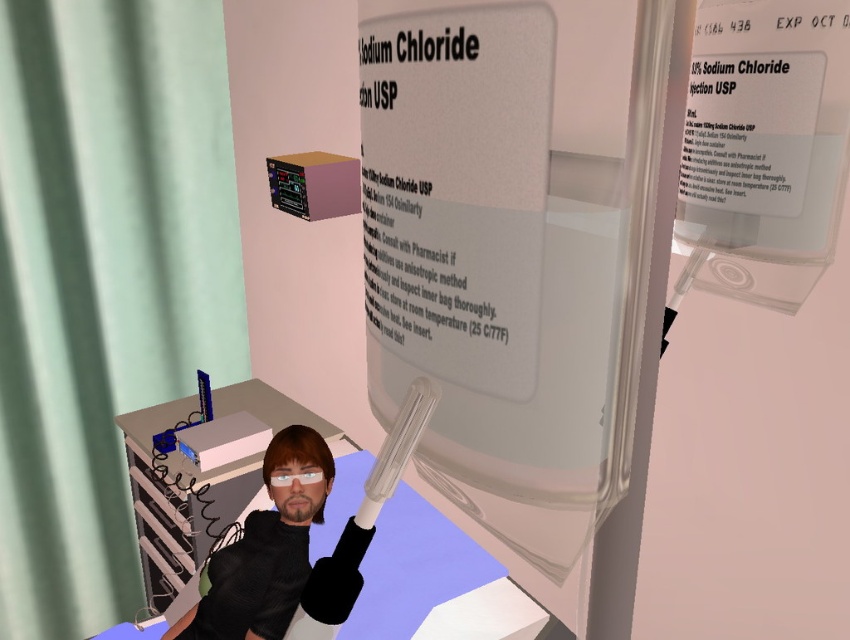
Question: Does light green fabric curtain at left have a larger size compared to smooth black shirt at center?

Choices:
 (A) yes
 (B) no

Answer: (A)

Question: Among these objects, which one is farthest from the camera?

Choices:
 (A) smooth black shirt at center
 (B) light green fabric curtain at left

Answer: (B)

Question: From the image, what is the correct spatial relationship of light green fabric curtain at left in relation to smooth black shirt at center?

Choices:
 (A) above
 (B) below

Answer: (A)

Question: Does light green fabric curtain at left have a smaller size compared to smooth black shirt at center?

Choices:
 (A) no
 (B) yes

Answer: (A)